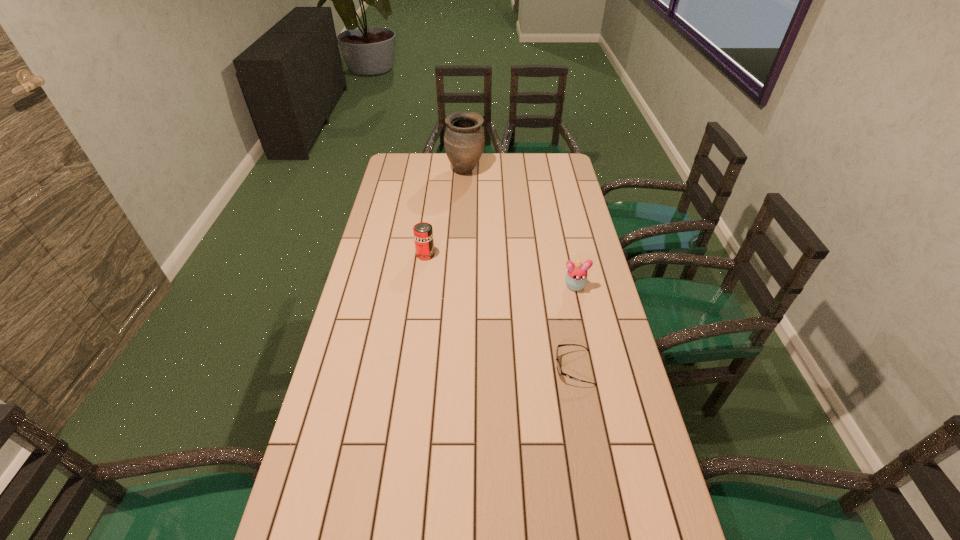
You are a GUI agent. You are given a task and a screenshot of the screen. Output one action in this format:
    pyautogui.click(x=<x>, y=<y>)
    Task: Click on the blank space located on the front-facing side of the shortest object
    The image size is (960, 540).
    Given the screenshot: What is the action you would take?
    (524, 368)

Locate an element on the screen. This screenshot has height=540, width=960. vacant space located 0.290m on the front-facing side of the shortest object is located at coordinates (456, 368).

This screenshot has height=540, width=960. What are the coordinates of `vacant space located 0.230m on the front-facing side of the shortest object` in the screenshot? It's located at (476, 368).

You are a GUI agent. You are given a task and a screenshot of the screen. Output one action in this format:
    pyautogui.click(x=<x>, y=<y>)
    Task: Click on the object that is positioned at the far edge
    This screenshot has width=960, height=540.
    Given the screenshot: What is the action you would take?
    pyautogui.click(x=464, y=140)

I want to click on cupcake that is at the right edge, so click(576, 278).

In order to click on sunglasses present at the right edge in this screenshot , I will do `click(560, 372)`.

This screenshot has height=540, width=960. Find the location of `blank space at the far edge`. blank space at the far edge is located at coordinates (489, 174).

Locate an element on the screen. Image resolution: width=960 pixels, height=540 pixels. free space at the left edge is located at coordinates (400, 292).

This screenshot has height=540, width=960. I want to click on free spot at the right edge of the desktop, so click(x=610, y=308).

Locate an element on the screen. This screenshot has width=960, height=540. free spot between the leftmost object and the sunglasses is located at coordinates (500, 311).